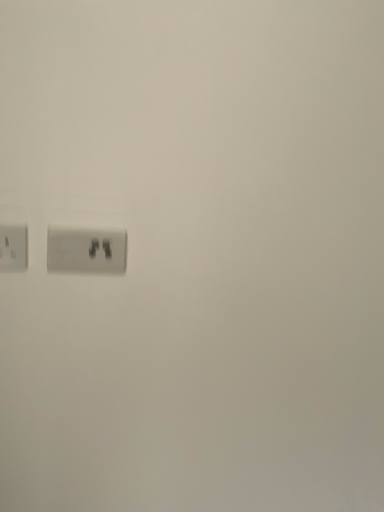
Question: Visually, is matte white power plug at left, the 2th power plugs and sockets viewed from the right, positioned to the left or to the right of white plastic power plugs and sockets at center, the second power plugs and sockets viewed from the left?

Choices:
 (A) right
 (B) left

Answer: (B)

Question: Considering the positions of matte white power plug at left, the 2th power plugs and sockets viewed from the right, and white plastic power plugs and sockets at center, marked as the first power plugs and sockets in a right-to-left arrangement, in the image, is matte white power plug at left, the 2th power plugs and sockets viewed from the right, bigger or smaller than white plastic power plugs and sockets at center, marked as the first power plugs and sockets in a right-to-left arrangement,?

Choices:
 (A) small
 (B) big

Answer: (A)

Question: In the image, is matte white power plug at left, the 2th power plugs and sockets viewed from the right, positioned in front of or behind white plastic power plugs and sockets at center, marked as the first power plugs and sockets in a right-to-left arrangement?

Choices:
 (A) behind
 (B) front

Answer: (B)

Question: In terms of height, does white plastic power plugs and sockets at center, marked as the first power plugs and sockets in a right-to-left arrangement, look taller or shorter compared to matte white power plug at left, the 2th power plugs and sockets viewed from the right?

Choices:
 (A) tall
 (B) short

Answer: (A)

Question: Based on their positions, is white plastic power plugs and sockets at center, marked as the first power plugs and sockets in a right-to-left arrangement, located to the left or right of matte white power plug at left, the 2th power plugs and sockets viewed from the right?

Choices:
 (A) right
 (B) left

Answer: (A)

Question: Considering the positions of white plastic power plugs and sockets at center, marked as the first power plugs and sockets in a right-to-left arrangement, and matte white power plug at left, the 2th power plugs and sockets viewed from the right, in the image, is white plastic power plugs and sockets at center, marked as the first power plugs and sockets in a right-to-left arrangement, bigger or smaller than matte white power plug at left, the 2th power plugs and sockets viewed from the right,?

Choices:
 (A) small
 (B) big

Answer: (B)

Question: Considering the positions of white plastic power plugs and sockets at center, marked as the first power plugs and sockets in a right-to-left arrangement, and matte white power plug at left, which is the first power plugs and sockets from left to right, in the image, is white plastic power plugs and sockets at center, marked as the first power plugs and sockets in a right-to-left arrangement, wider or thinner than matte white power plug at left, which is the first power plugs and sockets from left to right,?

Choices:
 (A) thin
 (B) wide

Answer: (B)